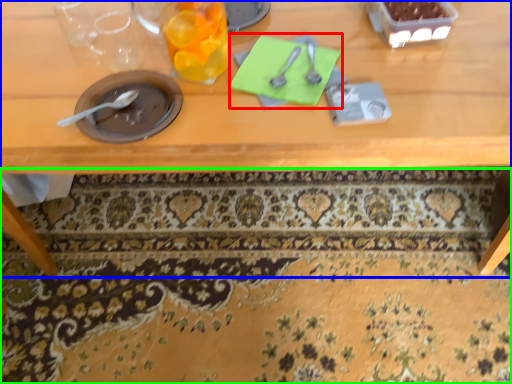
Question: Considering the real-world distances, which object is closest to notepad (highlighted by a red box)? table (highlighted by a blue box) or mat (highlighted by a green box).

Choices:
 (A) table
 (B) mat

Answer: (A)